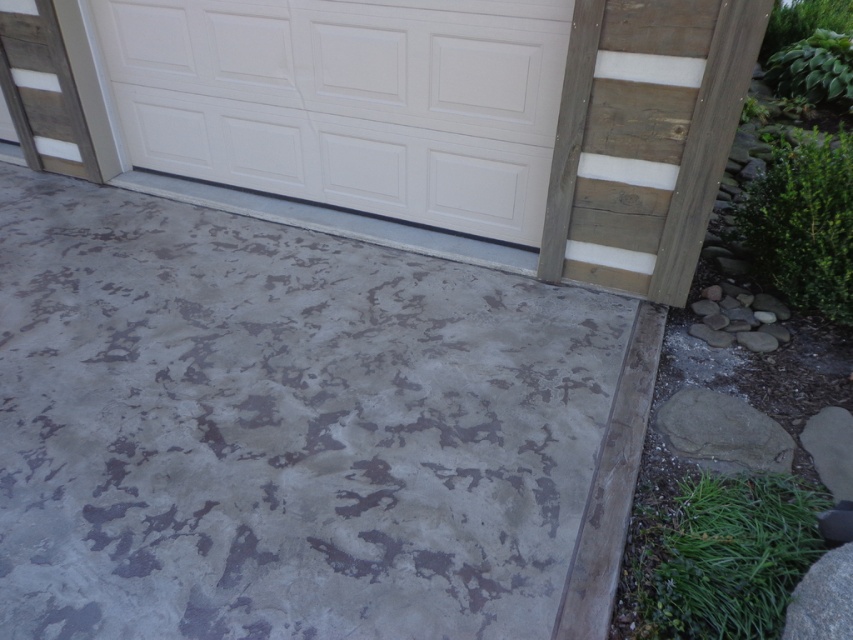
Question: Can you confirm if textured gray concrete at center is bigger than white painted wood door at upper center?

Choices:
 (A) no
 (B) yes

Answer: (B)

Question: Which object appears farthest from the camera in this image?

Choices:
 (A) white painted wood door at upper center
 (B) textured gray concrete at center

Answer: (A)

Question: Does textured gray concrete at center have a smaller size compared to white painted wood door at upper center?

Choices:
 (A) yes
 (B) no

Answer: (B)

Question: Can you confirm if textured gray concrete at center is positioned to the right of white painted wood door at upper center?

Choices:
 (A) yes
 (B) no

Answer: (B)

Question: Which point appears farthest from the camera in this image?

Choices:
 (A) (254, 160)
 (B) (424, 612)

Answer: (A)